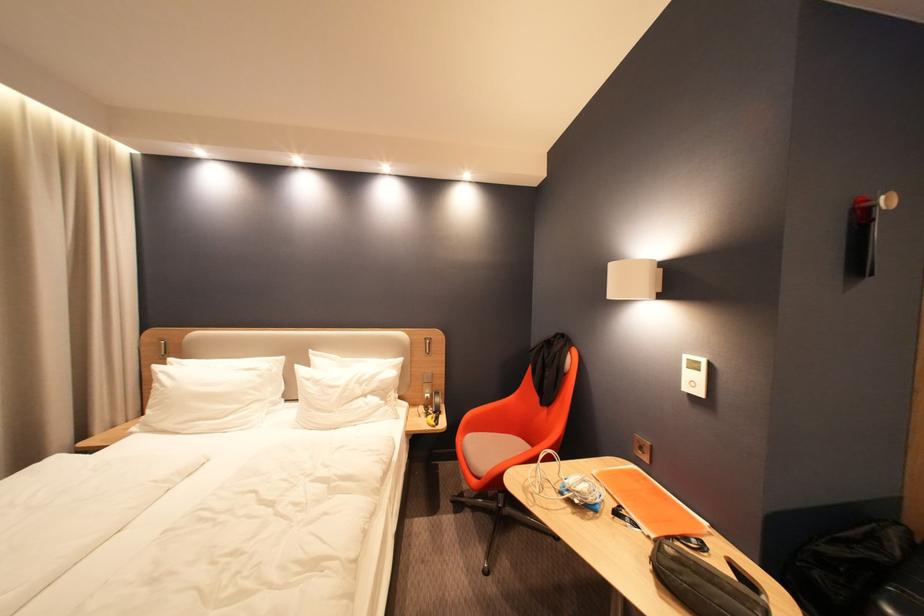
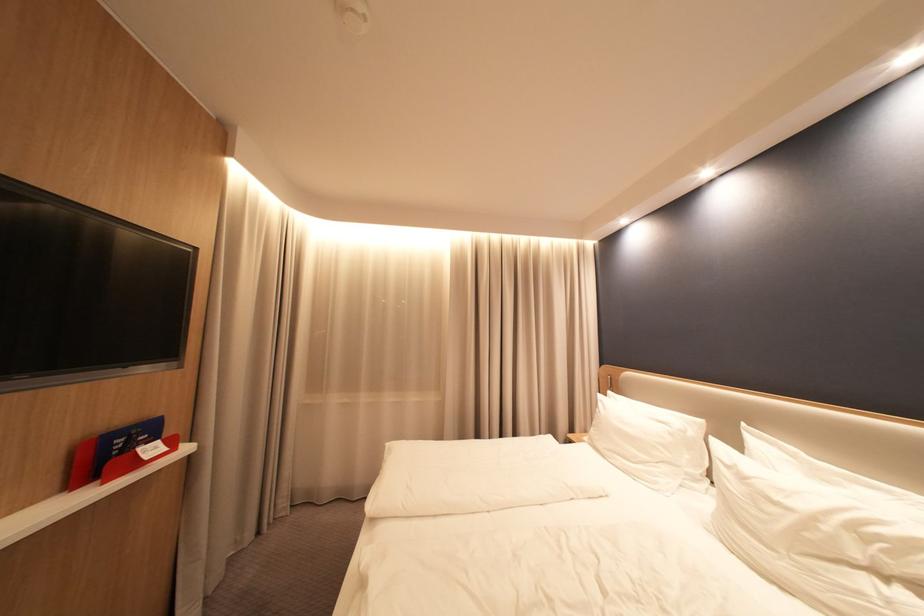
In the second image, find the point that corresponds to [318,379] in the first image.

(737, 464)